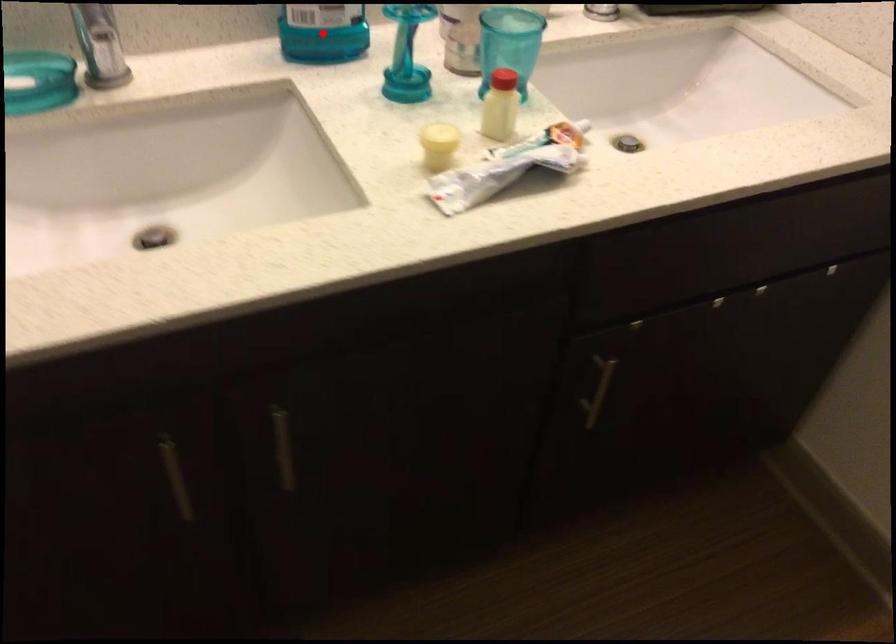
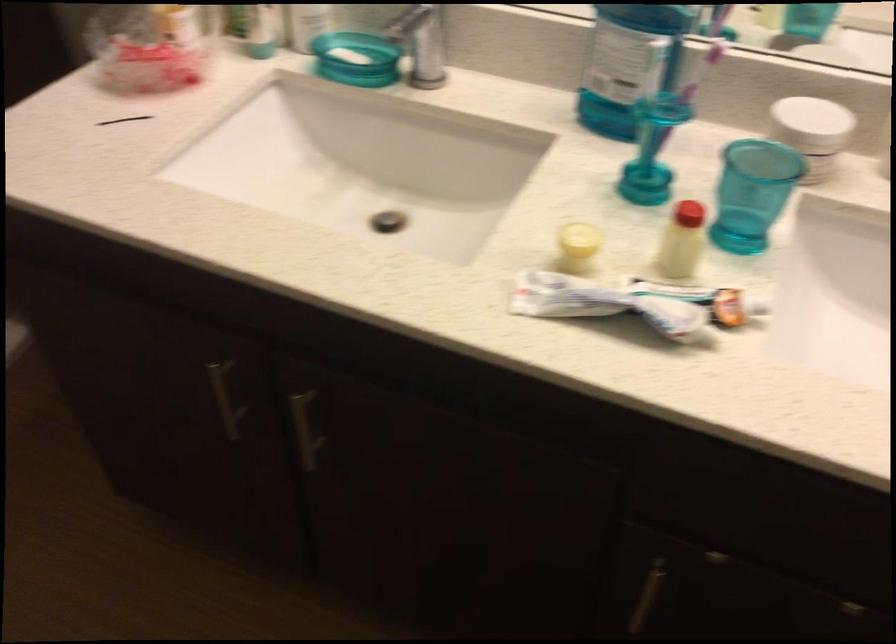
Question: I am providing you with two images of the same scene from different viewpoints. A red point is marked on the first image. At the location where the point appears in image 1, is it still visible in image 2?

Choices:
 (A) Yes
 (B) No

Answer: (B)